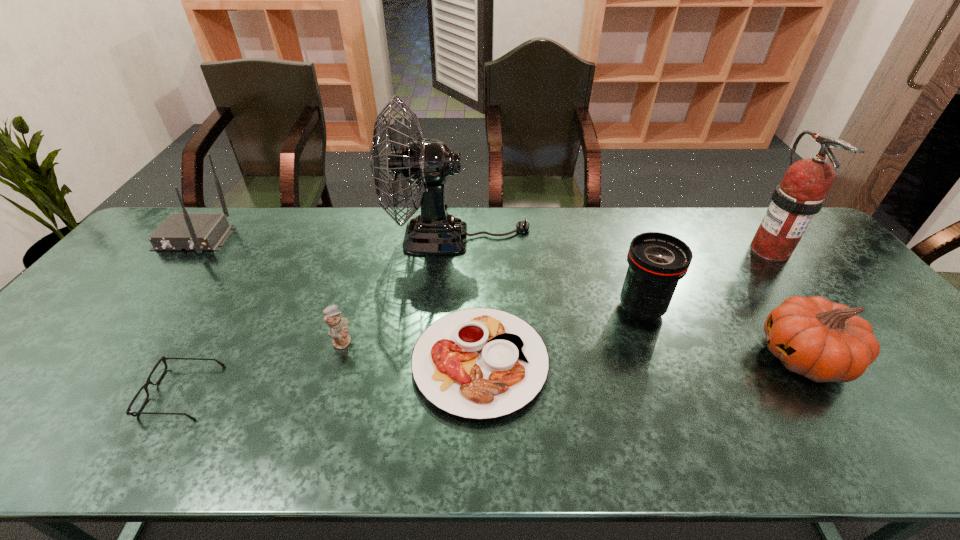
Where is `free space located in front of the fan, indicating the direction of air flow`? The width and height of the screenshot is (960, 540). free space located in front of the fan, indicating the direction of air flow is located at coordinates (592, 238).

This screenshot has height=540, width=960. What are the coordinates of `free space located 0.140m at the nozzle of the seventh shortest object` in the screenshot? It's located at (815, 307).

I want to click on vacant region located on the back of the third tallest object to connect cables, so click(x=162, y=279).

Find the location of `vacant area located on the right of the third object from right to left`. vacant area located on the right of the third object from right to left is located at coordinates tap(708, 308).

In order to click on free space located 0.290m on the face of the pumpkin in this screenshot , I will do `click(640, 357)`.

Find the location of a particular element. free space located 0.280m on the face of the pumpkin is located at coordinates (644, 357).

Identify the location of vacant space positioned 0.060m on the face of the pumpkin. (734, 357).

Where is `vacant space located 0.170m on the front-facing side of the teddy bear`? vacant space located 0.170m on the front-facing side of the teddy bear is located at coordinates 420,341.

What are the coordinates of `blank area located 0.130m on the back of the platter` in the screenshot? It's located at (480, 280).

Identify the location of free space located on the front-facing side of the second object from left to right. (12, 392).